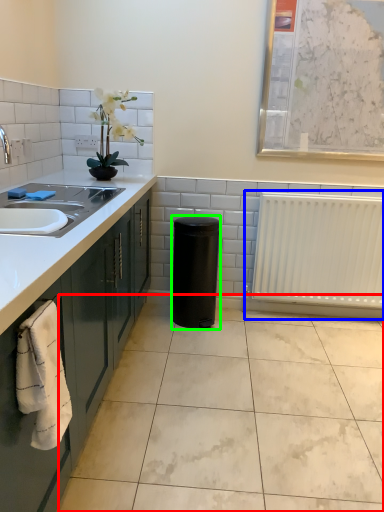
Question: Which object is positioned farthest from ceramic tile (highlighted by a red box)? Select from radiator (highlighted by a blue box) and appliance (highlighted by a green box).

Choices:
 (A) radiator
 (B) appliance

Answer: (A)